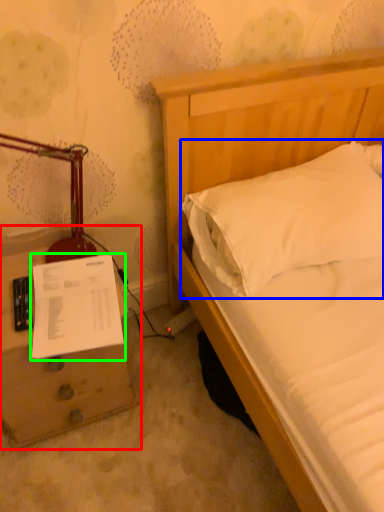
Question: Based on their relative distances, which object is nearer to nightstand (highlighted by a red box)? Choose from pillow (highlighted by a blue box) and document (highlighted by a green box).

Choices:
 (A) pillow
 (B) document

Answer: (B)